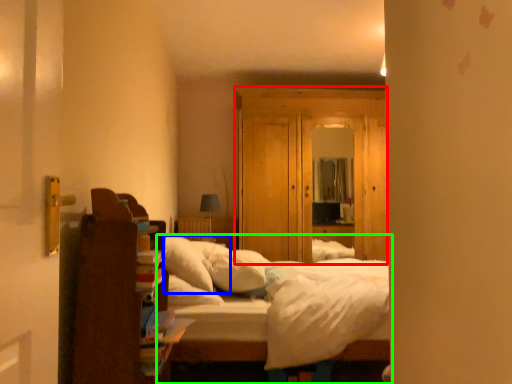
Question: Which object is positioned farthest from dresser (highlighted by a red box)? Select from pillow (highlighted by a blue box) and bed (highlighted by a green box).

Choices:
 (A) pillow
 (B) bed

Answer: (B)